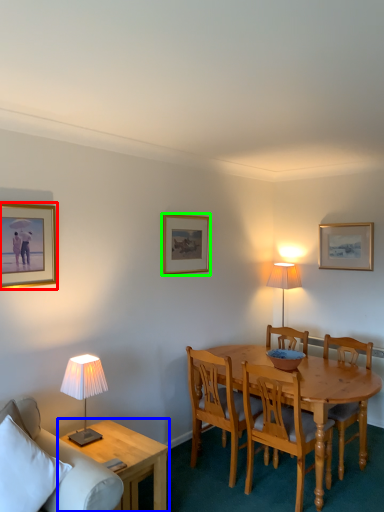
Question: Estimate the real-world distances between objects in this image. Which object is closer to picture frame (highlighted by a red box), coffee table (highlighted by a blue box) or picture frame (highlighted by a green box)?

Choices:
 (A) coffee table
 (B) picture frame

Answer: (B)